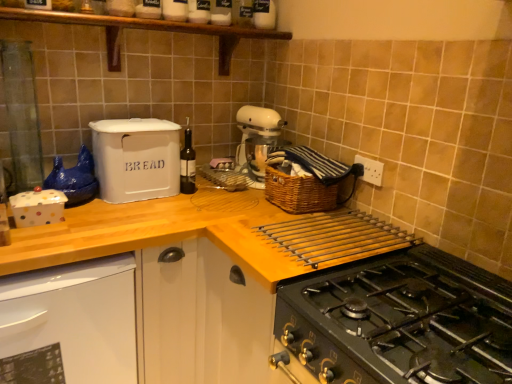
This screenshot has width=512, height=384. Identify the location of vacant area that is in front of white matte mixer at center. (228, 198).